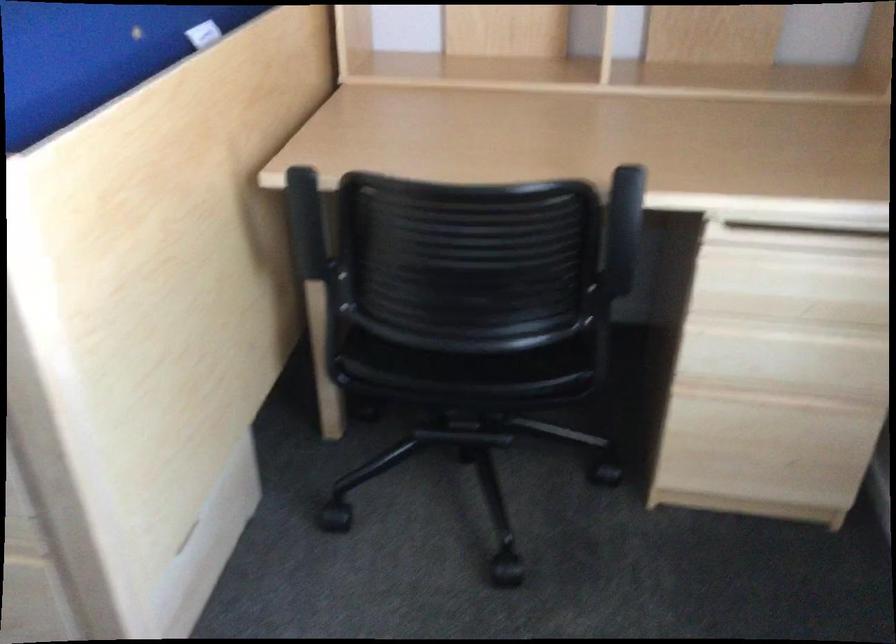
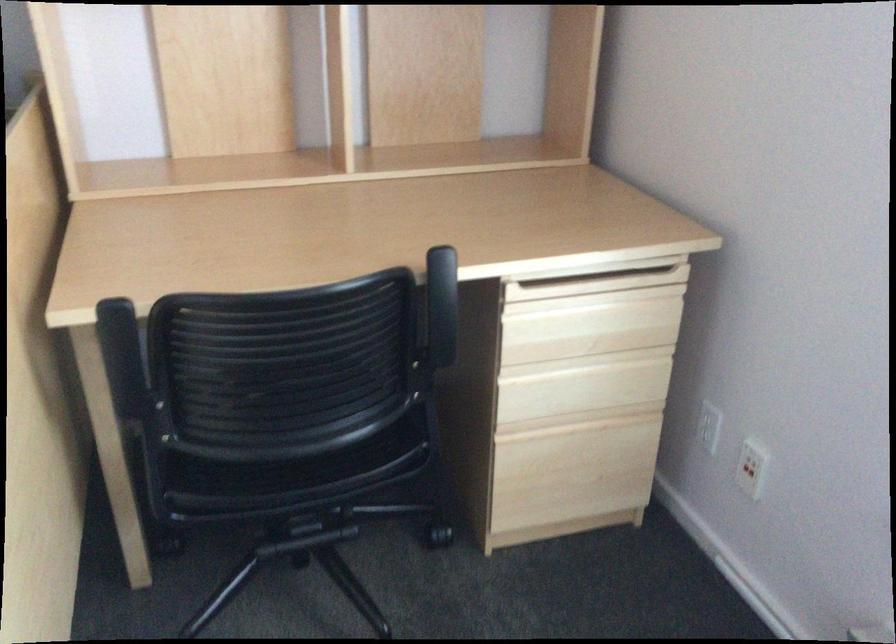
The point at [757,440] is marked in the first image. Where is the corresponding point in the second image?

(574, 465)